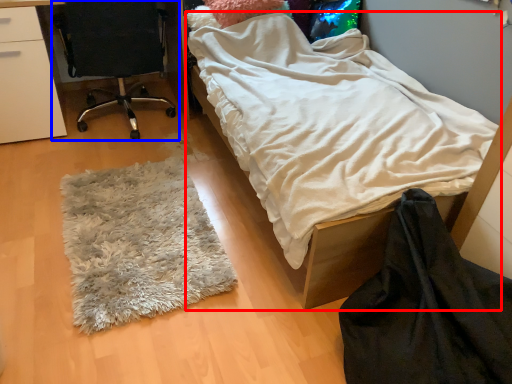
Question: Which point is closer to the camera, bed (highlighted by a red box) or chair (highlighted by a blue box)?

Choices:
 (A) bed
 (B) chair

Answer: (A)